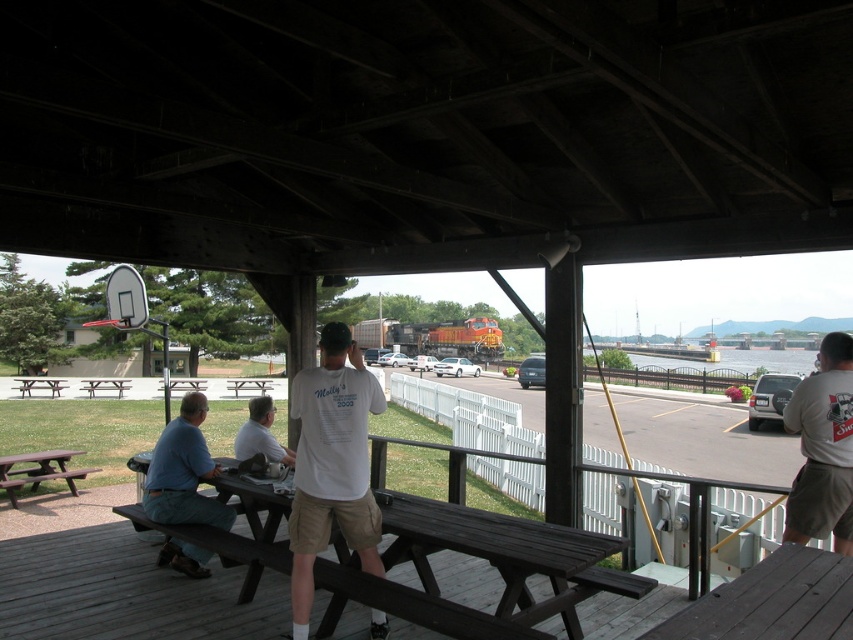
Question: Which object is positioned farthest from the silver metallic suv at lower right?

Choices:
 (A) dark brown wood deck at lower right
 (B) matte black van at center

Answer: (A)

Question: Which point is closer to the camera?

Choices:
 (A) (189, 499)
 (B) (834, 540)
 (C) (258, 381)
 (D) (390, 358)

Answer: (B)

Question: Which of these objects is positioned farthest from the brown wooden picnic table at center?

Choices:
 (A) silver metallic suv at lower right
 (B) brown wooden picnic table at lower left
 (C) white glossy car at center
 (D) brown wood picnic table at lower left

Answer: (A)

Question: Can you confirm if brown wood picnic table at lower left is positioned below matte black van at center?

Choices:
 (A) yes
 (B) no

Answer: (B)

Question: Can you confirm if brown wooden picnic table at left is bigger than brown wooden picnic table at lower left?

Choices:
 (A) yes
 (B) no

Answer: (B)

Question: Can you confirm if dark brown wood deck at lower right is thinner than white cotton t-shirt at right?

Choices:
 (A) no
 (B) yes

Answer: (A)